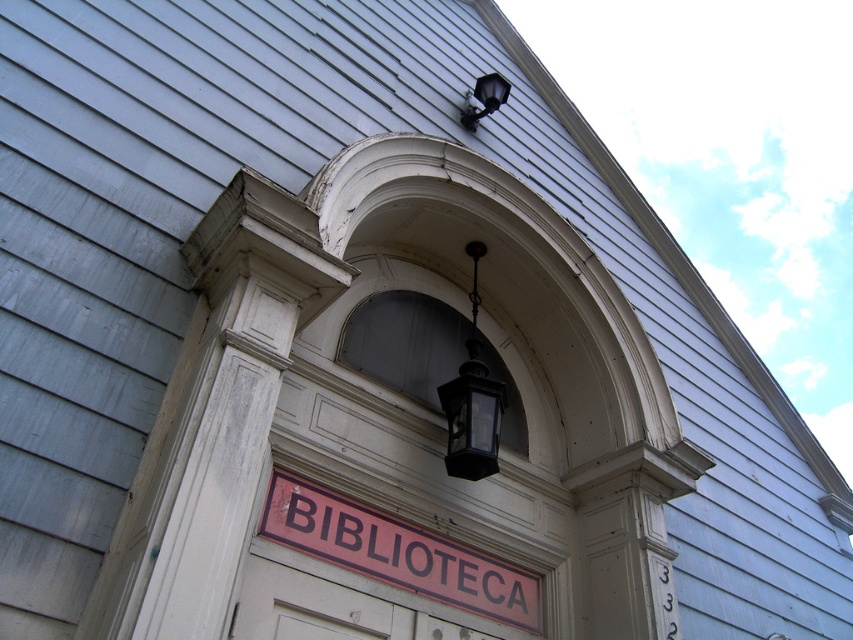
From the picture: You are standing at the entrance of the building and need to locate the white wooden door at center. Based on the coordinates provided in the description, can you determine its position relative to the arched doorway?

The white wooden door at center is located at coordinates point (331,609), which places it at the center of the entrance area, directly within the arched doorway as described in the scene. The coordinates align with the central position mentioned in the scene description.

You are a delivery person standing at the entrance of the building. You need to place a camera exactly 3.5 meters away from the red matte sign at center. Can you place the camera in the correct position based on the scene?

The red matte sign at center and camera are 3.53 meters apart from each other, so placing the camera 3.5 meters away would be approximately correct.